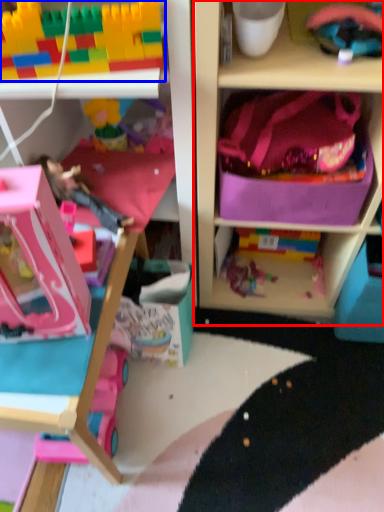
Question: Which object appears closest to the camera in this image, shelf (highlighted by a red box) or toy (highlighted by a blue box)?

Choices:
 (A) shelf
 (B) toy

Answer: (A)